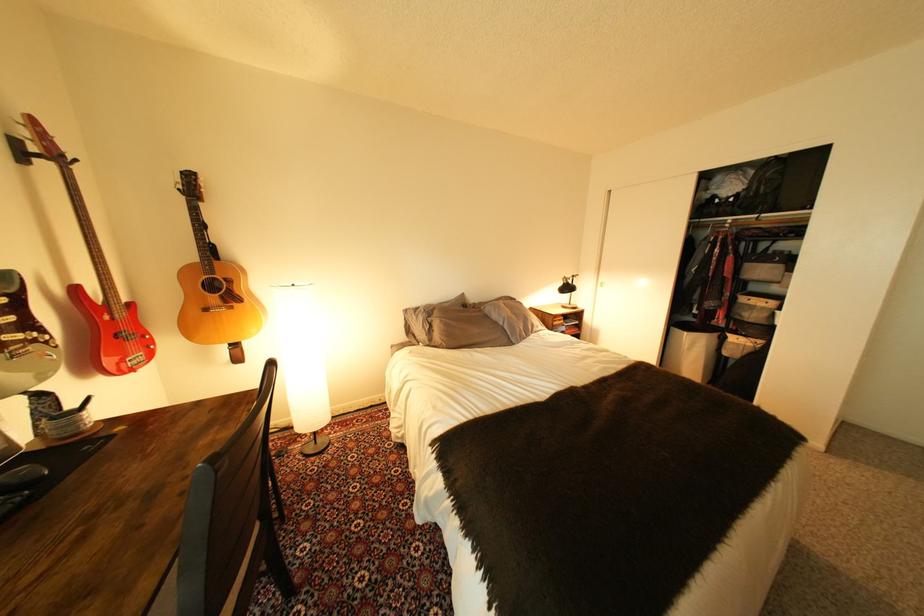
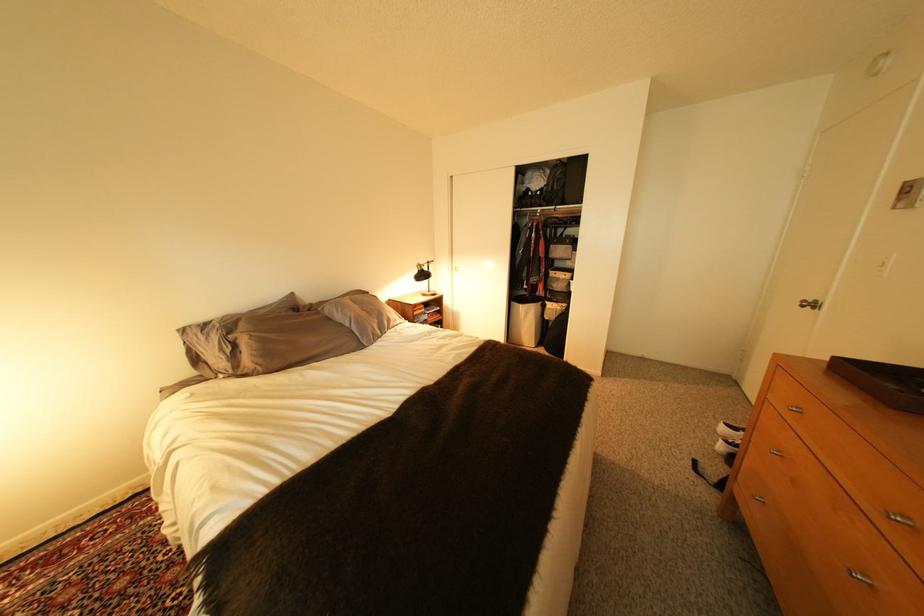
Locate, in the second image, the point that corresponds to [744,197] in the first image.

(550, 191)